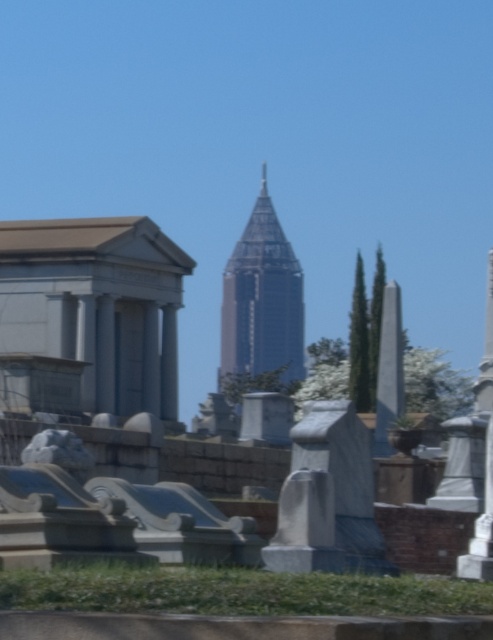
You are standing at the entrance of the cemetery and want to take a photo that includes both the shiny glass skyscraper at center and the white marble obelisk at right. Which object will appear larger in the photo?

The shiny glass skyscraper at center will appear larger in the photo because it is much taller than the white marble obelisk at right.

You are standing in the cemetery scene described. You notice two points marked in the image. Which point is closer to you, point (274, 211) or point (486, 392)?

Point (274, 211) is closer to you because it is further to the viewer than point (486, 392).

You are standing in the cemetery and want to take a photo of the shiny glass skyscraper at center. To ensure it fits in the frame, you need to know its position relative to the center of the image. Is the skyscraper positioned to the left or right of the exact center?

The shiny glass skyscraper at center is located at point coordinates approximately 0.481 on the x and 0.531 on the y axis. Since the exact center of the image would be at coordinates 0.5, the skyscraper is slightly to the left of the center point.